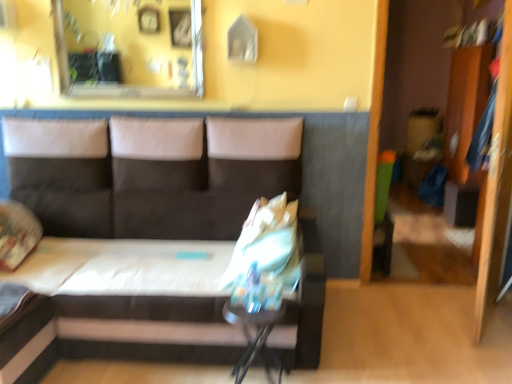
Question: Is clear glass mirror at upper center thinner than dark gray fabric couch at center?

Choices:
 (A) no
 (B) yes

Answer: (B)

Question: Considering the relative sizes of clear glass mirror at upper center and dark gray fabric couch at center in the image provided, is clear glass mirror at upper center taller than dark gray fabric couch at center?

Choices:
 (A) yes
 (B) no

Answer: (B)

Question: Considering the relative sizes of clear glass mirror at upper center and dark gray fabric couch at center in the image provided, is clear glass mirror at upper center bigger than dark gray fabric couch at center?

Choices:
 (A) no
 (B) yes

Answer: (A)

Question: Is clear glass mirror at upper center wider than dark gray fabric couch at center?

Choices:
 (A) yes
 (B) no

Answer: (B)

Question: Can you confirm if clear glass mirror at upper center is shorter than dark gray fabric couch at center?

Choices:
 (A) no
 (B) yes

Answer: (B)

Question: From the image's perspective, is metallic glossy table at lower center above or below dark gray fabric couch at center?

Choices:
 (A) above
 (B) below

Answer: (B)

Question: Considering the positions of metallic glossy table at lower center and dark gray fabric couch at center in the image, is metallic glossy table at lower center wider or thinner than dark gray fabric couch at center?

Choices:
 (A) wide
 (B) thin

Answer: (B)

Question: Choose the correct answer: Is metallic glossy table at lower center inside dark gray fabric couch at center or outside it?

Choices:
 (A) outside
 (B) inside

Answer: (B)

Question: Considering the positions of metallic glossy table at lower center and dark gray fabric couch at center in the image, is metallic glossy table at lower center taller or shorter than dark gray fabric couch at center?

Choices:
 (A) short
 (B) tall

Answer: (A)

Question: From their relative heights in the image, would you say wooden dresser at right is taller or shorter than dark gray fabric couch at center?

Choices:
 (A) short
 (B) tall

Answer: (B)

Question: Is point click(x=478, y=51) closer or farther from the camera than point click(x=286, y=342)?

Choices:
 (A) farther
 (B) closer

Answer: (A)

Question: From the image's perspective, is wooden dresser at right above or below dark gray fabric couch at center?

Choices:
 (A) below
 (B) above

Answer: (B)

Question: From a real-world perspective, is wooden dresser at right above or below dark gray fabric couch at center?

Choices:
 (A) below
 (B) above

Answer: (B)

Question: From the image's perspective, relative to metallic glossy table at lower center, is wooden dresser at right above or below?

Choices:
 (A) above
 (B) below

Answer: (A)

Question: Considering the positions of wooden dresser at right and metallic glossy table at lower center in the image, is wooden dresser at right bigger or smaller than metallic glossy table at lower center?

Choices:
 (A) small
 (B) big

Answer: (B)